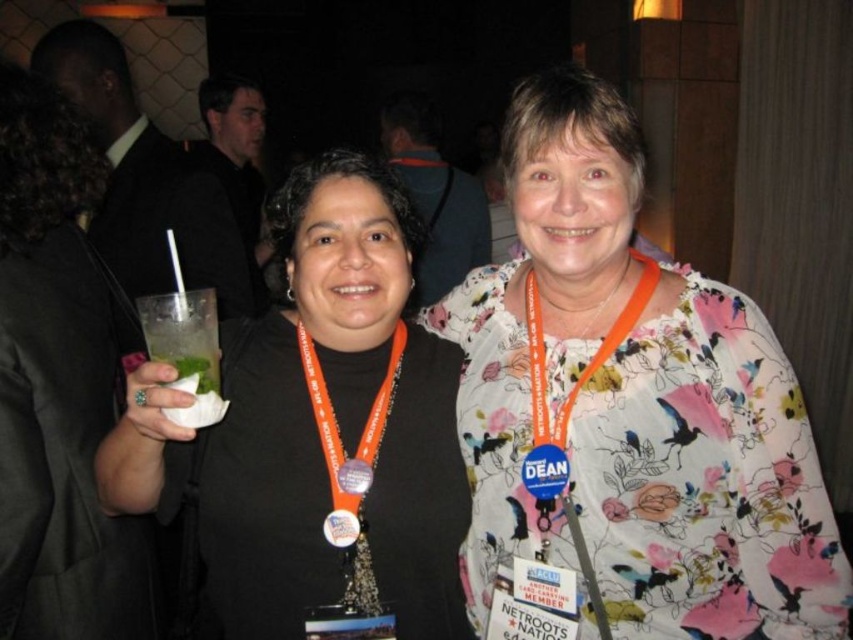
You are at a conference and need to identify which badge is easier to read from a distance. The badges are the metallic silver badge at center and the orange plastic badge at center. Which one would be more legible?

The orange plastic badge at center is thicker than the metallic silver badge at center, making it more legible from a distance.

From the picture: You are at a social event and want to approach the two women standing near each other. You notice two specific points in the scene marked as point 1 at coordinates point (608,310) and point 2 at coordinates point (354,522). Which point is closer to you as you approach them?

Point 1 at coordinates point (608,310) is closer to you because it is further to the viewer than point 2 at coordinates point (354,522).